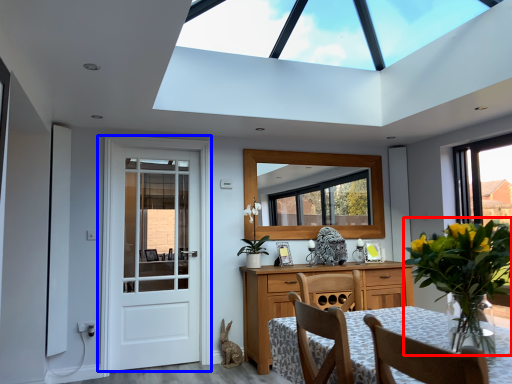
Question: Which point is further to the camera, floral arrangement (highlighted by a red box) or door (highlighted by a blue box)?

Choices:
 (A) floral arrangement
 (B) door

Answer: (B)